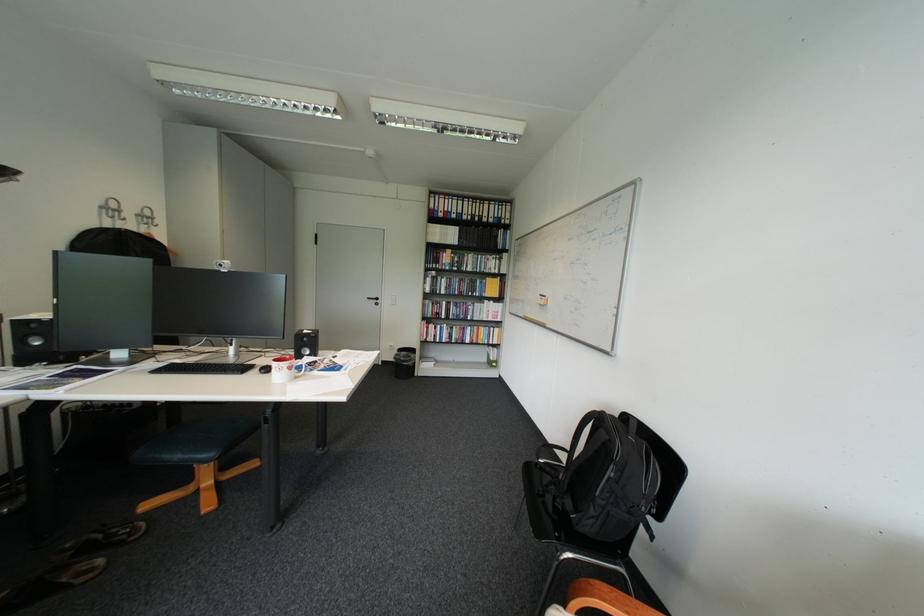
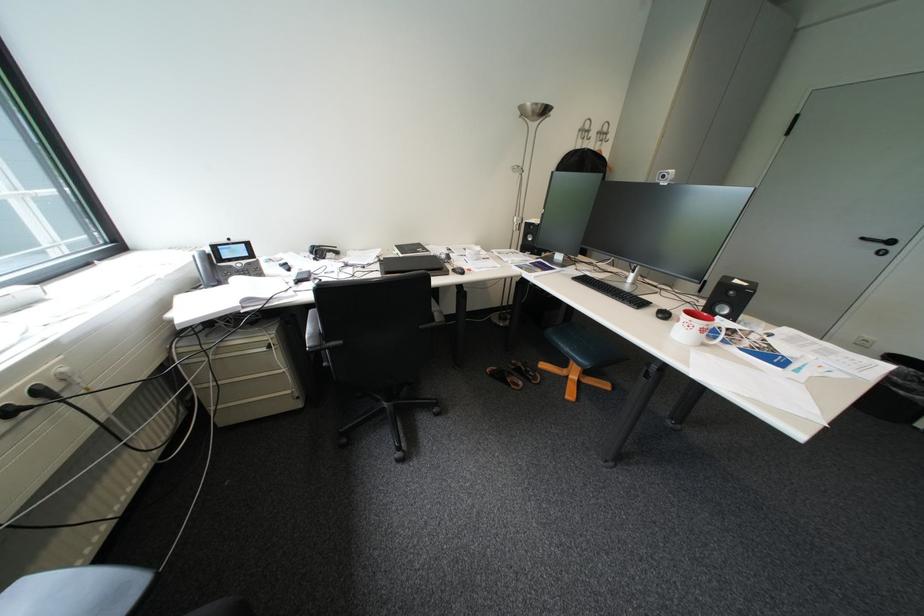
Find the pixel in the second image that matches (x=268, y=371) in the first image.

(663, 310)